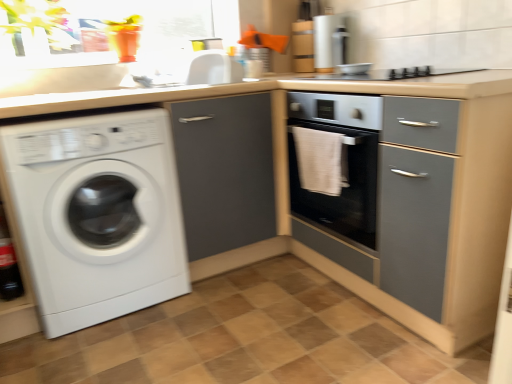
Question: In terms of size, does matte gray cabinet at center appear bigger or smaller than metallic silver bowl at upper center?

Choices:
 (A) big
 (B) small

Answer: (A)

Question: Would you say matte gray cabinet at center is inside or outside metallic silver bowl at upper center?

Choices:
 (A) outside
 (B) inside

Answer: (A)

Question: Estimate the real-world distances between objects in this image. Which object is farther from the white glossy sink at upper center?

Choices:
 (A) matte gray cabinet at center
 (B) white glossy washing machine at left
 (C) white towel at center
 (D) metallic silver bowl at upper center

Answer: (D)

Question: Which is farther from the metallic silver bowl at upper center?

Choices:
 (A) white towel at center
 (B) white glossy sink at upper center
 (C) white glossy washing machine at left
 (D) matte gray cabinet at center

Answer: (C)